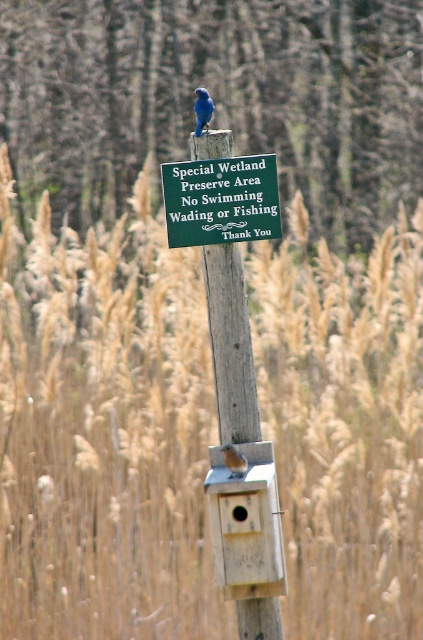
Which of these two, wooden post at center or blue matte bird at upper center, stands shorter?

blue matte bird at upper center

Does wooden post at center have a lesser width compared to blue matte bird at upper center?

No, wooden post at center is not thinner than blue matte bird at upper center.

Which is in front, point (214, 257) or point (195, 102)?

Point (195, 102)

You are a GUI agent. You are given a task and a screenshot of the screen. Output one action in this format:
    pyautogui.click(x=<x>, y=<y>)
    Task: Click on the wooden post at center
    The image size is (423, 640).
    Given the screenshot: What is the action you would take?
    pyautogui.click(x=230, y=342)

The height and width of the screenshot is (640, 423). Describe the element at coordinates (246, 524) in the screenshot. I see `wooden bird feeder at center` at that location.

Does point (224, 563) come behind point (209, 104)?

That is False.

At what (x,y) coordinates should I click in order to perform the action: click on wooden bird feeder at center. Please return your answer as a coordinate pair (x, y). The height and width of the screenshot is (640, 423). Looking at the image, I should click on (246, 524).

Locate an element on the screen. wooden bird feeder at center is located at coordinates (246, 524).

Can you confirm if brown wood pole at center is wider than wooden bird feeder at center?

Yes.

This screenshot has height=640, width=423. In order to click on brown wood pole at center in this screenshot , I will do `click(216, 99)`.

Between point (41, 84) and point (282, 579), which one is positioned behind?

The point (41, 84) is behind.

Where is `brown wood pole at center`? brown wood pole at center is located at coordinates [x=216, y=99].